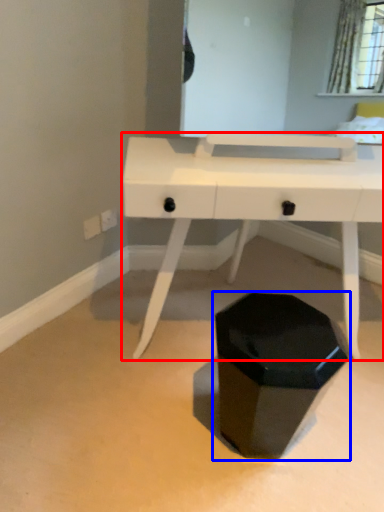
Question: Which of the following is the farthest to the observer, desk (highlighted by a red box) or waste container (highlighted by a blue box)?

Choices:
 (A) desk
 (B) waste container

Answer: (A)